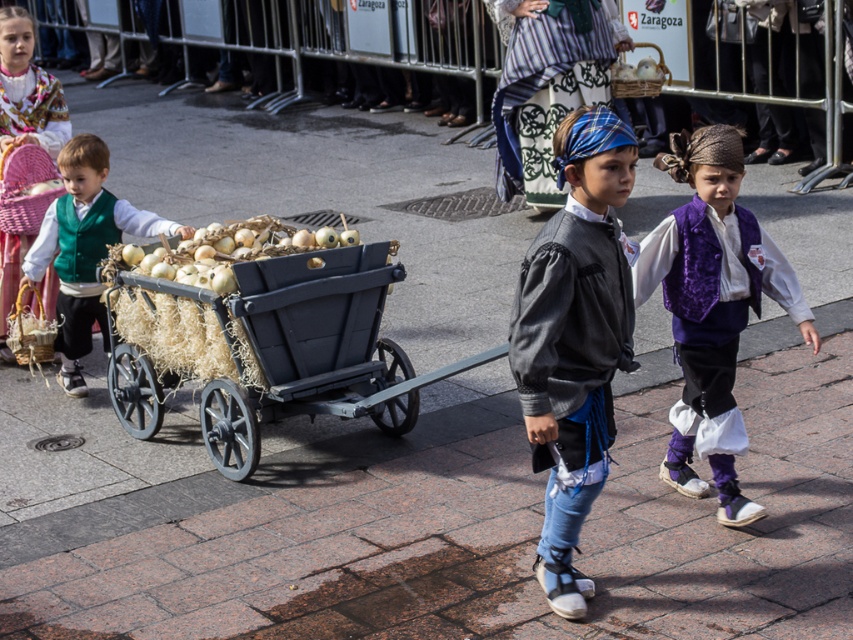
Is purple velvet vest at center shorter than beige straw hay at center?

In fact, purple velvet vest at center may be taller than beige straw hay at center.

Is purple velvet vest at center thinner than beige straw hay at center?

Indeed, purple velvet vest at center has a lesser width compared to beige straw hay at center.

You are a GUI agent. You are given a task and a screenshot of the screen. Output one action in this format:
    pyautogui.click(x=<x>, y=<y>)
    Task: Click on the purple velvet vest at center
    This screenshot has height=640, width=853.
    Given the screenshot: What is the action you would take?
    pyautogui.click(x=712, y=307)

The height and width of the screenshot is (640, 853). Identify the location of purple velvet vest at center. (712, 307).

Between gray fabric shirt at center and beige straw hay at center, which one is positioned higher?

beige straw hay at center is above.

Which is below, gray fabric shirt at center or beige straw hay at center?

gray fabric shirt at center

What do you see at coordinates (573, 339) in the screenshot? I see `gray fabric shirt at center` at bounding box center [573, 339].

Where is `gray fabric shirt at center`? The height and width of the screenshot is (640, 853). gray fabric shirt at center is located at coordinates (573, 339).

Based on the photo, does gray fabric shirt at center lie in front of black wooden wagon at center?

Yes, gray fabric shirt at center is in front of black wooden wagon at center.

Which of these two, gray fabric shirt at center or black wooden wagon at center, stands taller?

Standing taller between the two is gray fabric shirt at center.

The width and height of the screenshot is (853, 640). What are the coordinates of `gray fabric shirt at center` in the screenshot? It's located at (573, 339).

Locate an element on the screen. The height and width of the screenshot is (640, 853). gray fabric shirt at center is located at coordinates (573, 339).